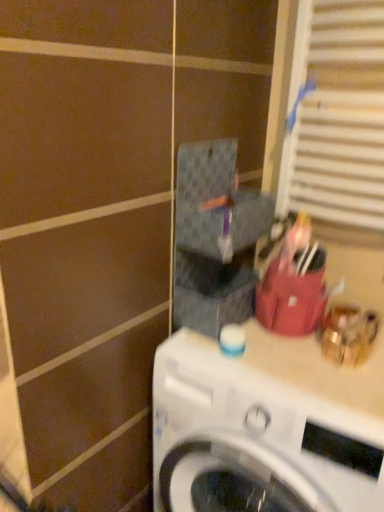
Question: Is white glossy washing machine at center touching white textured blinds at upper right?

Choices:
 (A) yes
 (B) no

Answer: (B)

Question: Does white glossy washing machine at center have a smaller size compared to white textured blinds at upper right?

Choices:
 (A) yes
 (B) no

Answer: (B)

Question: Does white glossy washing machine at center appear on the right side of white textured blinds at upper right?

Choices:
 (A) yes
 (B) no

Answer: (B)

Question: Is white glossy washing machine at center not inside white textured blinds at upper right?

Choices:
 (A) no
 (B) yes

Answer: (B)

Question: Is white glossy washing machine at center oriented away from white textured blinds at upper right?

Choices:
 (A) yes
 (B) no

Answer: (B)

Question: Can you confirm if white glossy washing machine at center is thinner than white textured blinds at upper right?

Choices:
 (A) yes
 (B) no

Answer: (B)

Question: Is white glossy washing machine at center at the back of white textured blinds at upper right?

Choices:
 (A) no
 (B) yes

Answer: (A)

Question: From the image's perspective, does white textured blinds at upper right appear lower than white glossy washing machine at center?

Choices:
 (A) no
 (B) yes

Answer: (A)

Question: Does white textured blinds at upper right appear on the left side of white glossy washing machine at center?

Choices:
 (A) yes
 (B) no

Answer: (B)

Question: Can you confirm if white textured blinds at upper right is smaller than white glossy washing machine at center?

Choices:
 (A) no
 (B) yes

Answer: (B)

Question: Is white textured blinds at upper right shorter than white glossy washing machine at center?

Choices:
 (A) no
 (B) yes

Answer: (B)

Question: From a real-world perspective, is white textured blinds at upper right physically below white glossy washing machine at center?

Choices:
 (A) yes
 (B) no

Answer: (B)

Question: Does point (321, 382) appear closer or farther from the camera than point (304, 114)?

Choices:
 (A) farther
 (B) closer

Answer: (B)